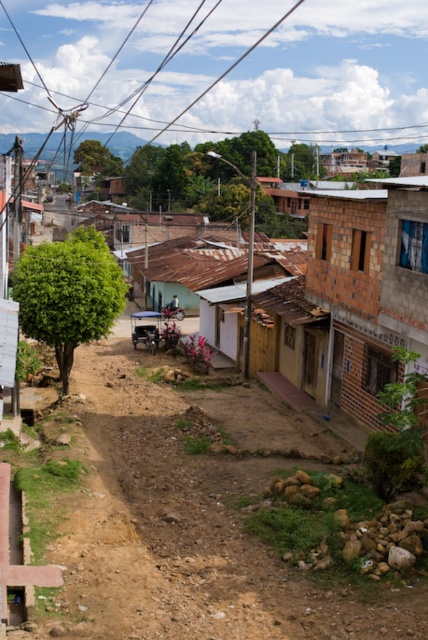
Question: Among these points, which one is nearest to the camera?

Choices:
 (A) (252, 566)
 (B) (392, 268)

Answer: (A)

Question: Which of the following is the closest to the observer?

Choices:
 (A) brown brick house at center
 (B) brown dirt track at center

Answer: (B)

Question: Is brown dirt track at center positioned behind brick wall house at right?

Choices:
 (A) yes
 (B) no

Answer: (B)

Question: Does brown dirt track at center have a greater width compared to brick wall house at right?

Choices:
 (A) yes
 (B) no

Answer: (A)

Question: Which of the following is the farthest from the observer?

Choices:
 (A) (294, 282)
 (B) (124, 472)
 (C) (385, 381)

Answer: (A)

Question: Does brown brick house at center have a smaller size compared to brick wall house at right?

Choices:
 (A) yes
 (B) no

Answer: (B)